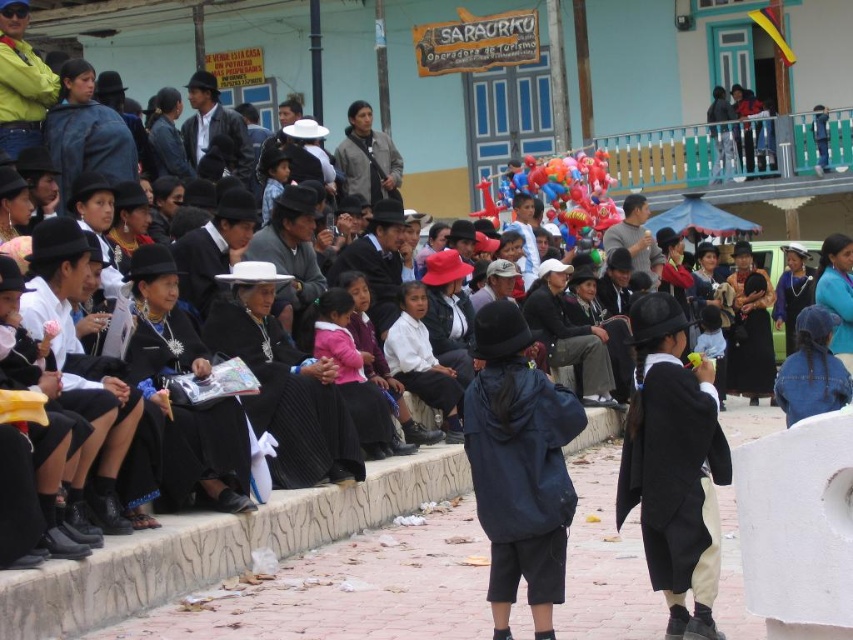
Between navy blue fabric jacket at center and multicolored glossy balloons at center, which one appears on the right side from the viewer's perspective?

Positioned to the right is multicolored glossy balloons at center.

Is navy blue fabric jacket at center shorter than multicolored glossy balloons at center?

Incorrect, navy blue fabric jacket at center's height does not fall short of multicolored glossy balloons at center's.

Where is `navy blue fabric jacket at center`? The width and height of the screenshot is (853, 640). navy blue fabric jacket at center is located at coordinates (519, 467).

At what (x,y) coordinates should I click in order to perform the action: click on navy blue fabric jacket at center. Please return your answer as a coordinate pair (x, y). This screenshot has height=640, width=853. Looking at the image, I should click on (519, 467).

Is the position of matte black coat at center more distant than that of multicolored glossy balloons at center?

No, matte black coat at center is closer to the viewer.

Can you confirm if matte black coat at center is bigger than multicolored glossy balloons at center?

Correct, matte black coat at center is larger in size than multicolored glossy balloons at center.

Which is behind, point (640, 301) or point (538, 188)?

The point (538, 188) is more distant.

Locate an element on the screen. The width and height of the screenshot is (853, 640). matte black coat at center is located at coordinates (672, 465).

The image size is (853, 640). What do you see at coordinates (519, 467) in the screenshot?
I see `navy blue fabric jacket at center` at bounding box center [519, 467].

Is point (538, 381) more distant than point (614, 518)?

No, (538, 381) is in front of (614, 518).

Which is in front, point (555, 490) or point (648, 442)?

Positioned in front is point (555, 490).

The image size is (853, 640). What are the coordinates of `navy blue fabric jacket at center` in the screenshot? It's located at (519, 467).